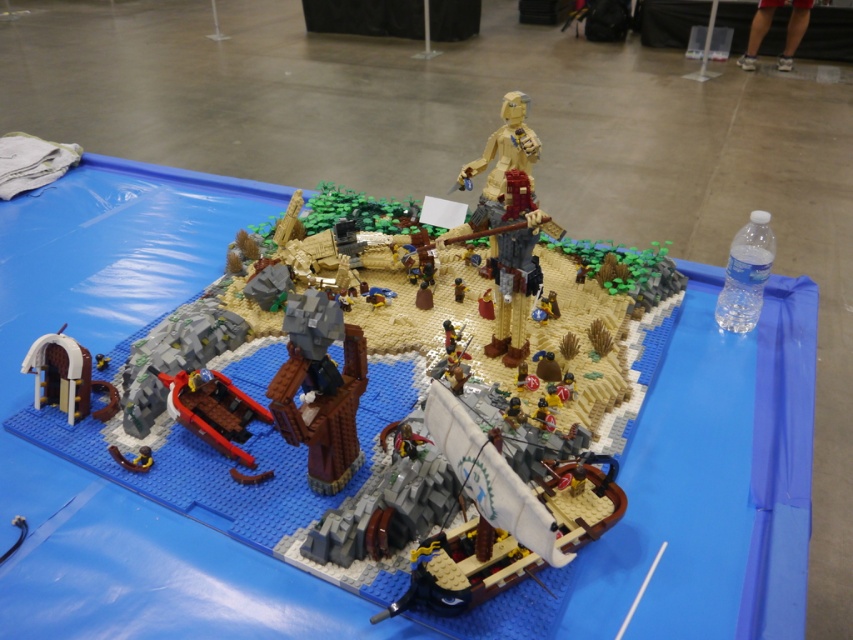
You are a tiny LEGO figure standing on the sandy beach near the metallic blue sword at lower left. You want to climb up to the top of the dark brown wood tree trunk at center to get a better view. Is the tree trunk tall enough to provide a higher vantage point than where you are currently standing?

The dark brown wood tree trunk at center is much taller than the metallic blue sword at lower left, so yes, climbing it would give a higher vantage point compared to your current position near the sword.

You are a LEGO figure standing at the brown wooden archway at lower left. You want to reach the metallic blue sword at lower left to defend yourself from an incoming attack. Can you safely move to the sword without crossing any obstacles?

The distance between the brown wooden archway at lower left and the metallic blue sword at lower left is 18.37 centimeters. Since there are no mentioned obstacles in the scene description, you can safely move to the sword.